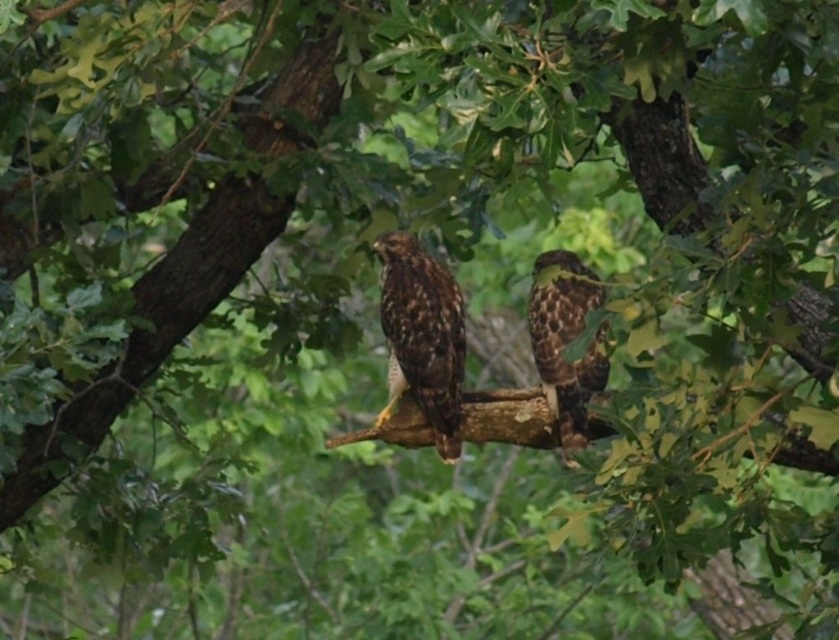
Between brown feathered eagle at center and brown speckled eagle at center, which one has more height?

brown feathered eagle at center is taller.

The height and width of the screenshot is (640, 839). What do you see at coordinates (421, 337) in the screenshot? I see `brown feathered eagle at center` at bounding box center [421, 337].

Who is more forward, (430,404) or (535,317)?

Point (535,317) is more forward.

I want to click on brown feathered eagle at center, so click(x=421, y=337).